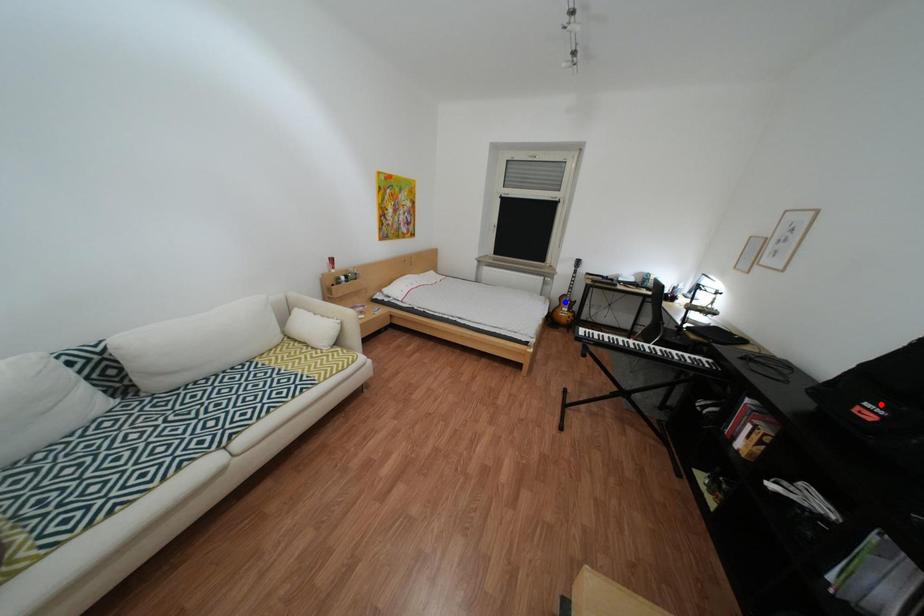
Question: Which of the two points in the image is closer to the camera?

Choices:
 (A) Blue point is closer.
 (B) Red point is closer.

Answer: (B)